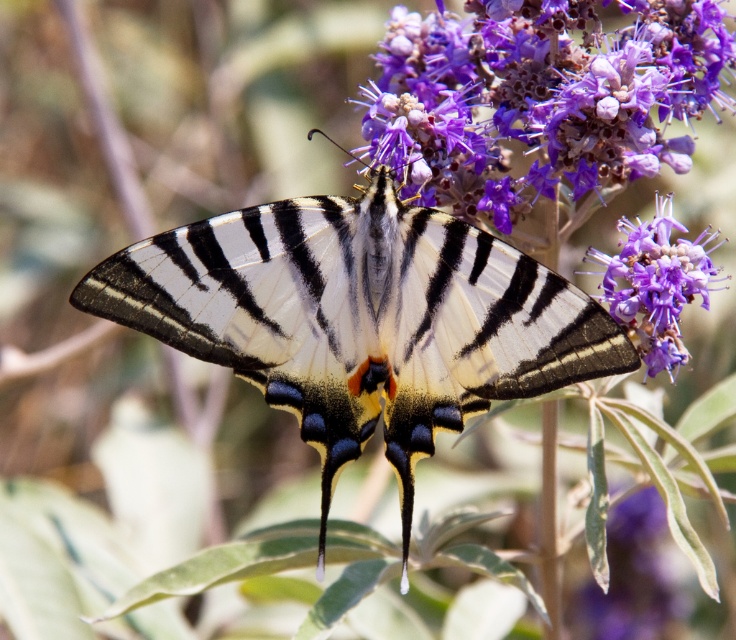
Can you confirm if shiny metallic butterfly at center is thinner than purple matte flower at upper center?

In fact, shiny metallic butterfly at center might be wider than purple matte flower at upper center.

Who is positioned more to the right, shiny metallic butterfly at center or purple matte flower at upper center?

From the viewer's perspective, purple matte flower at upper center appears more on the right side.

What are the coordinates of `shiny metallic butterfly at center` in the screenshot? It's located at (360, 320).

Is point (584, 170) behind point (629, 288)?

Yes, it is.

The height and width of the screenshot is (640, 736). I want to click on purple matte flower at upper center, so click(x=539, y=99).

Identify the location of purple matte flower at upper center. The width and height of the screenshot is (736, 640). (539, 99).

Can you confirm if shiny metallic butterfly at center is positioned above purple fuzzy flower at center?

No.

Looking at this image, between shiny metallic butterfly at center and purple fuzzy flower at center, which one has less height?

With less height is purple fuzzy flower at center.

Is point (492, 355) closer to viewer compared to point (690, 243)?

Yes, it is.

The width and height of the screenshot is (736, 640). In order to click on shiny metallic butterfly at center in this screenshot , I will do `click(360, 320)`.